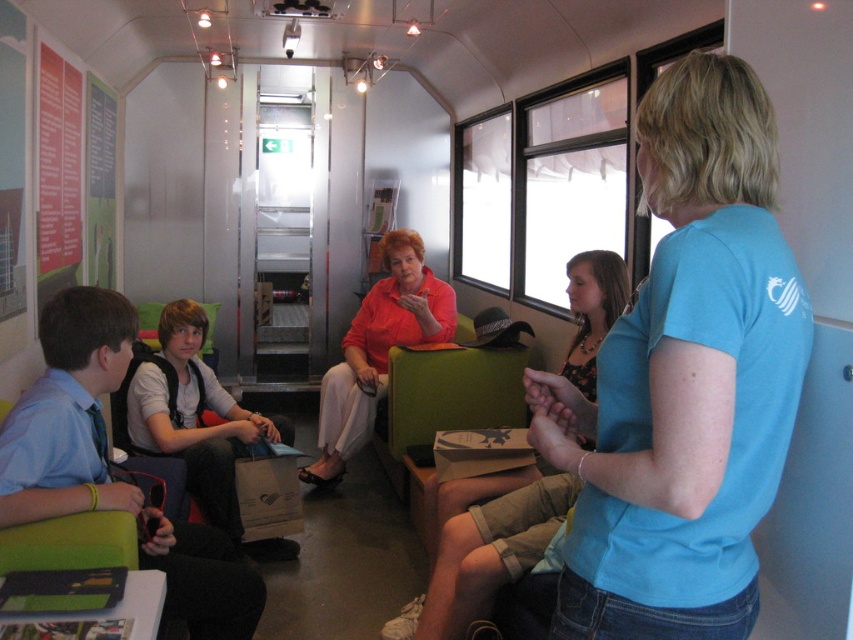
Question: Is matte black backpack at left positioned behind green matte poster at upper left?

Choices:
 (A) yes
 (B) no

Answer: (B)

Question: Which object is the closest to the blue cotton shirt at upper right?

Choices:
 (A) matte orange shirt at center
 (B) green matte poster at upper left
 (C) matte black backpack at left

Answer: (C)

Question: Can you confirm if blue cotton shirt at upper right is smaller than matte orange shirt at center?

Choices:
 (A) yes
 (B) no

Answer: (A)

Question: Among these objects, which one is farthest from the camera?

Choices:
 (A) blue cotton shirt at upper right
 (B) matte black backpack at left
 (C) green matte poster at upper left

Answer: (C)

Question: Is green matte poster at upper left above matte orange shirt at center?

Choices:
 (A) no
 (B) yes

Answer: (B)

Question: Which point is farther to the camera?

Choices:
 (A) (42, 54)
 (B) (370, 289)

Answer: (B)